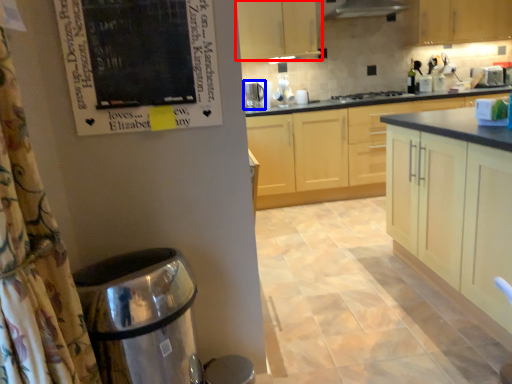
Question: Among these objects, which one is farthest to the camera, cabinetry (highlighted by a red box) or kitchen appliance (highlighted by a blue box)?

Choices:
 (A) cabinetry
 (B) kitchen appliance

Answer: (B)